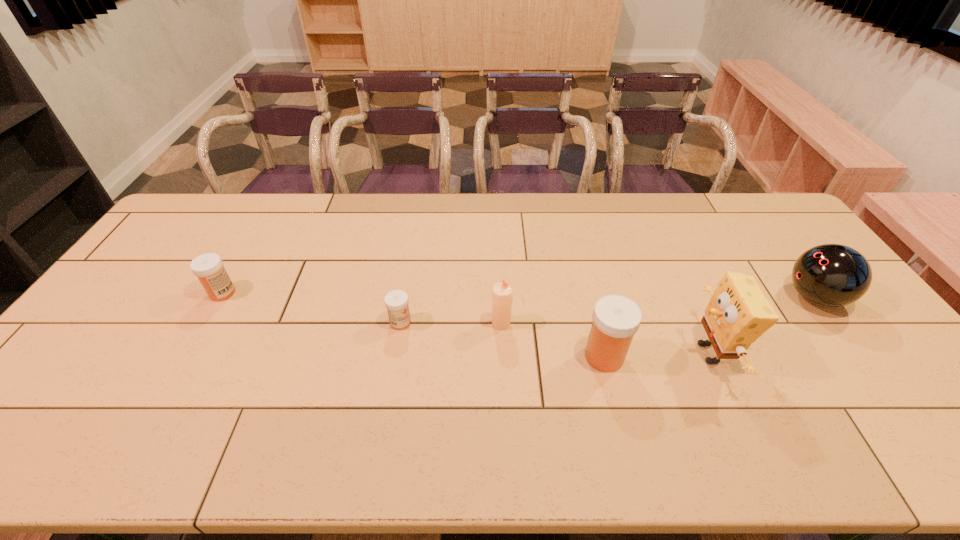
Locate an element on the screen. This screenshot has width=960, height=540. the second tallest medicine is located at coordinates (208, 267).

Where is `the farthest medicine`? The height and width of the screenshot is (540, 960). the farthest medicine is located at coordinates (208, 267).

You are a GUI agent. You are given a task and a screenshot of the screen. Output one action in this format:
    pyautogui.click(x=<x>, y=<y>)
    Task: Click on the second nearest medicine
    
    Given the screenshot: What is the action you would take?
    pyautogui.click(x=396, y=301)

Find the location of a particular element. The image size is (960, 540). the shortest object is located at coordinates (396, 301).

In order to click on the third object from right to left in this screenshot , I will do `click(616, 319)`.

Where is `the rightmost medicine`? This screenshot has width=960, height=540. the rightmost medicine is located at coordinates (616, 319).

Where is `candle`? This screenshot has width=960, height=540. candle is located at coordinates (502, 294).

Identify the location of the rightmost object. The image size is (960, 540). (830, 275).

This screenshot has height=540, width=960. I want to click on the second object from right to left, so click(x=737, y=314).

The width and height of the screenshot is (960, 540). Find the location of `the tallest object`. the tallest object is located at coordinates (737, 314).